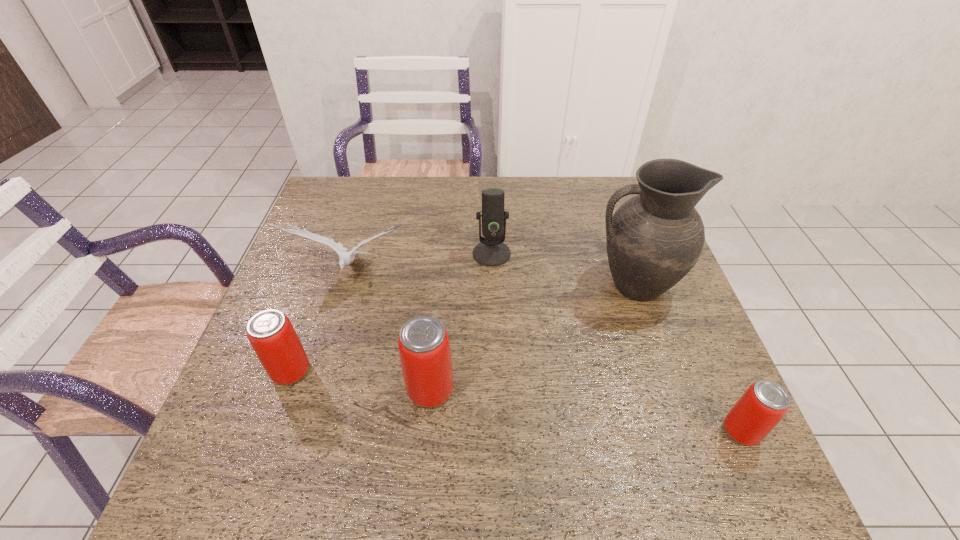
At what (x,y) coordinates should I click in order to perform the action: click on vacant position for inserting another beer_can evenly. Please return your answer as a coordinate pair (x, y). The image size is (960, 540). Looking at the image, I should click on (580, 409).